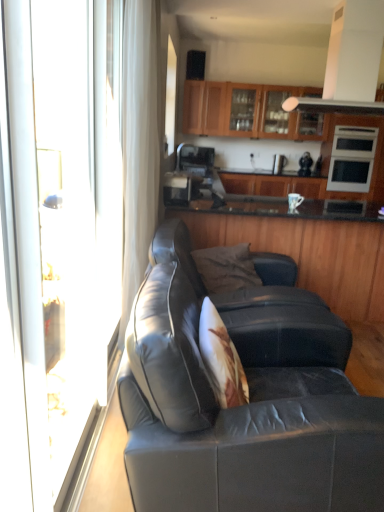
Question: Would you say satin silver microwave at upper right, which ranks as the first appliance in right-to-left order, is part of transparent glass screen door at left's contents?

Choices:
 (A) yes
 (B) no

Answer: (B)

Question: Is transparent glass screen door at left smaller than satin silver microwave at upper right, which ranks as the fourth appliance in left-to-right order?

Choices:
 (A) yes
 (B) no

Answer: (A)

Question: From the image's perspective, is transparent glass screen door at left located above satin silver microwave at upper right, placed as the second appliance when sorted from front to back?

Choices:
 (A) no
 (B) yes

Answer: (A)

Question: Is transparent glass screen door at left far away from satin silver microwave at upper right, placed as the second appliance when sorted from front to back?

Choices:
 (A) no
 (B) yes

Answer: (B)

Question: From the image's perspective, would you say transparent glass screen door at left is shown under satin silver microwave at upper right, placed as the second appliance when sorted from front to back?

Choices:
 (A) yes
 (B) no

Answer: (A)

Question: From the image's perspective, is white sheer curtain at upper left above or below satin black coffee machine at center, which is counted as the first appliance, starting from the left?

Choices:
 (A) below
 (B) above

Answer: (B)

Question: Looking at the image, does white sheer curtain at upper left seem bigger or smaller compared to satin black coffee machine at center, positioned as the 4th appliance in back-to-front order?

Choices:
 (A) big
 (B) small

Answer: (A)

Question: In the image, is white sheer curtain at upper left positioned in front of or behind satin black coffee machine at center, positioned as the 4th appliance in back-to-front order?

Choices:
 (A) behind
 (B) front

Answer: (B)

Question: Visually, is white sheer curtain at upper left positioned to the left or to the right of satin black coffee machine at center, marked as the 1th appliance in a front-to-back arrangement?

Choices:
 (A) left
 (B) right

Answer: (A)

Question: From the image's perspective, is satin silver microwave at upper right, placed as the second appliance when sorted from front to back, positioned above or below transparent glass screen door at left?

Choices:
 (A) above
 (B) below

Answer: (A)

Question: Is satin silver microwave at upper right, which ranks as the first appliance in right-to-left order, inside or outside of transparent glass screen door at left?

Choices:
 (A) outside
 (B) inside

Answer: (A)

Question: In terms of size, does satin silver microwave at upper right, which ranks as the first appliance in right-to-left order, appear bigger or smaller than transparent glass screen door at left?

Choices:
 (A) small
 (B) big

Answer: (B)

Question: In terms of height, does satin silver microwave at upper right, placed as the second appliance when sorted from front to back, look taller or shorter compared to transparent glass screen door at left?

Choices:
 (A) short
 (B) tall

Answer: (A)

Question: Looking at their shapes, would you say wooden cabinets at upper center, the third cabinetry ordered from the bottom, is wider or thinner than matte black leather couch at center?

Choices:
 (A) wide
 (B) thin

Answer: (B)

Question: From a real-world perspective, is wooden cabinets at upper center, the first cabinetry in the top-to-bottom sequence, positioned above or below matte black leather couch at center?

Choices:
 (A) below
 (B) above

Answer: (B)